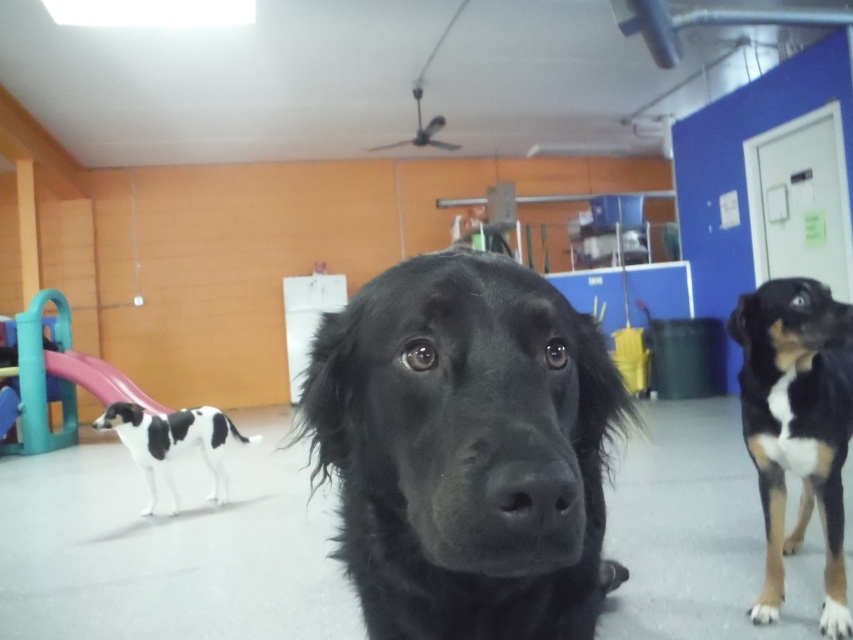
You are a daycare worker trying to separate the brown and white fur dog at center and the black and white fur dog at left into two different play areas. Which dog requires a larger play area based on their size?

The brown and white fur dog at center requires a larger play area because it has a larger size compared to the black and white fur dog at left.